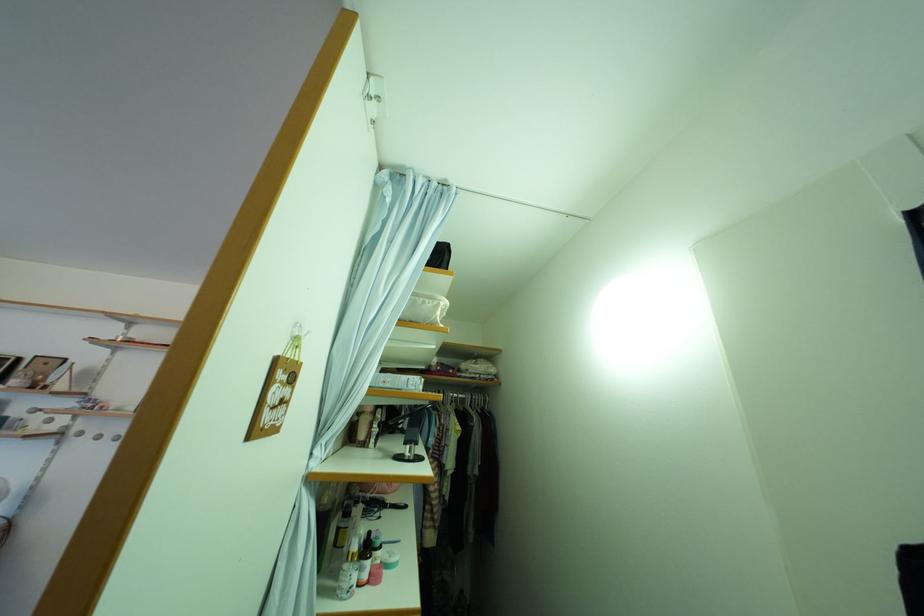
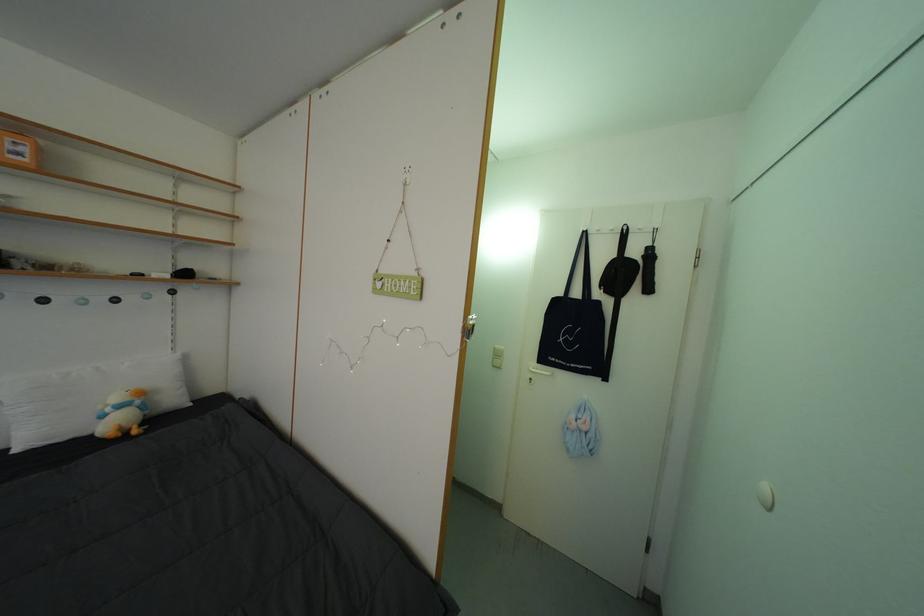
The first image is from the beginning of the video and the second image is from the end. How did the camera likely rotate when shooting the video?

The camera's rotation is toward right-down.